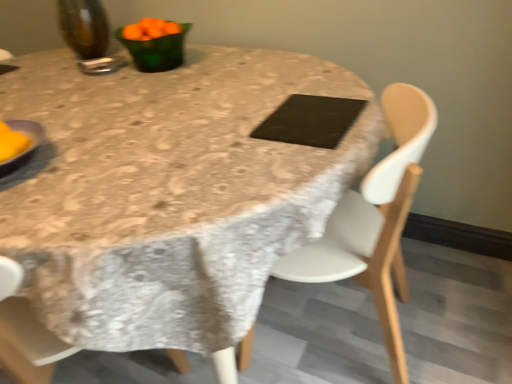
Where is `vacant region to the left of green glass bowl at upper left, the 2th tableware when ordered from left to right`? This screenshot has width=512, height=384. vacant region to the left of green glass bowl at upper left, the 2th tableware when ordered from left to right is located at coordinates (99, 68).